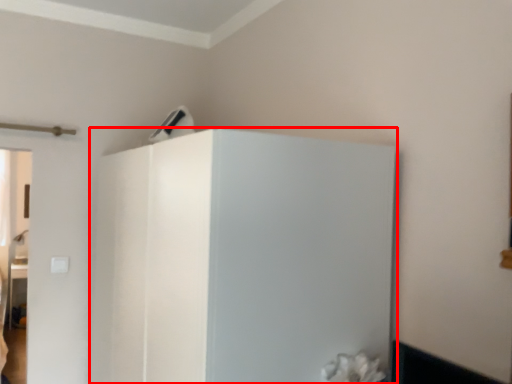
Question: From the image's perspective, what is the correct spatial relationship of fridge (annotated by the red box) in relation to appliance?

Choices:
 (A) below
 (B) above

Answer: (A)